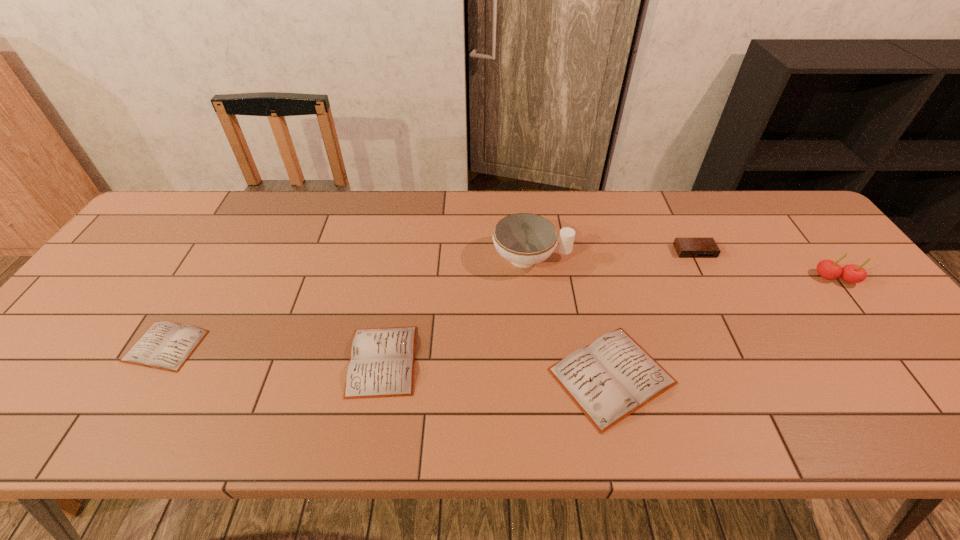
Image resolution: width=960 pixels, height=540 pixels. Identify the location of the shortest object. (165, 345).

Identify the location of the leftmost object. (165, 345).

This screenshot has height=540, width=960. I want to click on the second shortest diary, so click(x=382, y=360).

Image resolution: width=960 pixels, height=540 pixels. I want to click on the fifth object from right to left, so click(x=382, y=360).

Identify the location of the rightmost diary. The image size is (960, 540). (609, 379).

Find the location of a particular element. the third shortest object is located at coordinates (609, 379).

Where is `chinaware`? chinaware is located at coordinates (524, 239).

At what (x,y) coordinates should I click in order to perform the action: click on the rightmost object. Please return your answer as a coordinate pair (x, y). The width and height of the screenshot is (960, 540). Looking at the image, I should click on (828, 269).

I want to click on alarm clock, so click(685, 247).

I want to click on the third tallest object, so click(x=685, y=247).